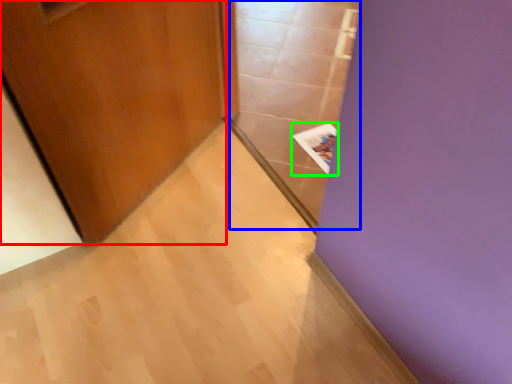
Question: Estimate the real-world distances between objects in this image. Which object is closer to door (highlighted by a red box), glass door (highlighted by a blue box) or magazine (highlighted by a green box)?

Choices:
 (A) glass door
 (B) magazine

Answer: (A)